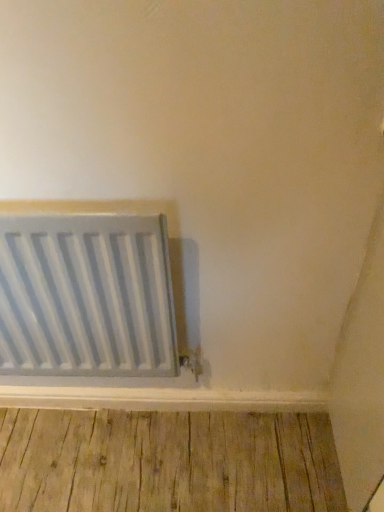
Question: Can you confirm if metallic silver radiator at lower left is taller than natural wood floor at bottom?

Choices:
 (A) yes
 (B) no

Answer: (A)

Question: Is metallic silver radiator at lower left shorter than natural wood floor at bottom?

Choices:
 (A) yes
 (B) no

Answer: (B)

Question: Is metallic silver radiator at lower left positioned before natural wood floor at bottom?

Choices:
 (A) no
 (B) yes

Answer: (B)

Question: Is metallic silver radiator at lower left smaller than natural wood floor at bottom?

Choices:
 (A) yes
 (B) no

Answer: (B)

Question: Is metallic silver radiator at lower left wider than natural wood floor at bottom?

Choices:
 (A) yes
 (B) no

Answer: (B)

Question: Could you tell me if metallic silver radiator at lower left is facing natural wood floor at bottom?

Choices:
 (A) yes
 (B) no

Answer: (B)

Question: From the image's perspective, is natural wood floor at bottom under metallic silver radiator at lower left?

Choices:
 (A) yes
 (B) no

Answer: (A)

Question: Is the position of natural wood floor at bottom more distant than that of metallic silver radiator at lower left?

Choices:
 (A) yes
 (B) no

Answer: (A)

Question: Is natural wood floor at bottom outside metallic silver radiator at lower left?

Choices:
 (A) yes
 (B) no

Answer: (A)

Question: Are natural wood floor at bottom and metallic silver radiator at lower left located far from each other?

Choices:
 (A) no
 (B) yes

Answer: (A)

Question: From a real-world perspective, is natural wood floor at bottom on metallic silver radiator at lower left?

Choices:
 (A) yes
 (B) no

Answer: (B)

Question: Can you confirm if natural wood floor at bottom is positioned to the right of metallic silver radiator at lower left?

Choices:
 (A) no
 (B) yes

Answer: (B)

Question: From the image's perspective, relative to natural wood floor at bottom, is metallic silver radiator at lower left above or below?

Choices:
 (A) above
 (B) below

Answer: (A)